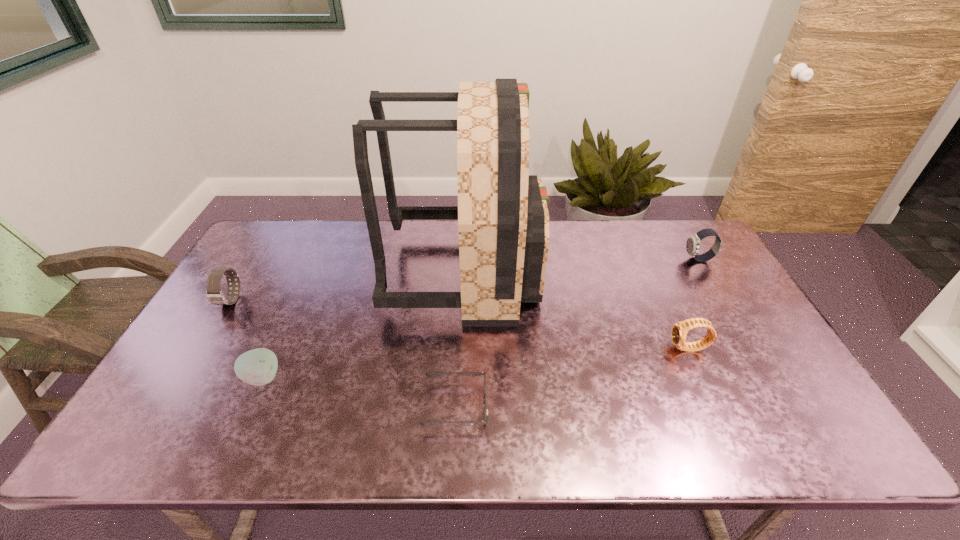
You are a GUI agent. You are given a task and a screenshot of the screen. Output one action in this format:
    pyautogui.click(x=<x>, y=<y>)
    Task: Click on the free spot between the fifth object from right to left and the second farthest watch
    The height and width of the screenshot is (540, 960).
    Given the screenshot: What is the action you would take?
    pyautogui.click(x=247, y=339)

In order to click on free spot between the shortest object and the apple in this screenshot , I will do `click(359, 392)`.

At what (x,y) coordinates should I click in order to perform the action: click on free space between the shortest object and the rightmost object. Please return your answer as a coordinate pair (x, y). Looking at the image, I should click on (578, 333).

At what (x,y) coordinates should I click in order to perform the action: click on vacant area between the leftmost object and the backpack. Please return your answer as a coordinate pair (x, y). The width and height of the screenshot is (960, 540). Looking at the image, I should click on (348, 286).

In order to click on empty space that is in between the apple and the tallest object in this screenshot , I will do `click(363, 325)`.

The image size is (960, 540). Identify the location of vacant space in between the shortest object and the second nearest watch. (344, 353).

Find the location of a particular element. This screenshot has width=960, height=540. free point between the leftmost object and the apple is located at coordinates (247, 339).

Where is `unoccupied position between the fourth farthest object and the apple`? The width and height of the screenshot is (960, 540). unoccupied position between the fourth farthest object and the apple is located at coordinates (476, 363).

The image size is (960, 540). Identify the location of free space between the fifth object from left to right and the farthest watch. pos(694,304).

The width and height of the screenshot is (960, 540). I want to click on unoccupied position between the farthest watch and the sunglasses, so click(578, 333).